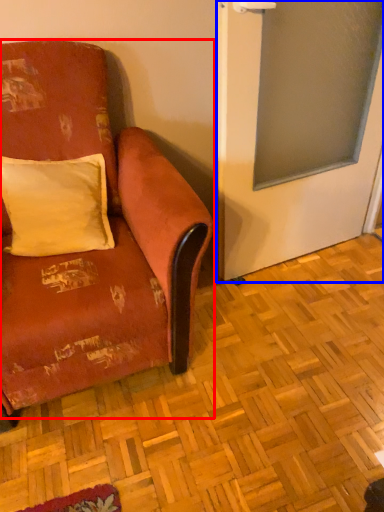
Question: Which object appears farthest to the camera in this image, studio couch (highlighted by a red box) or screen door (highlighted by a blue box)?

Choices:
 (A) studio couch
 (B) screen door

Answer: (B)